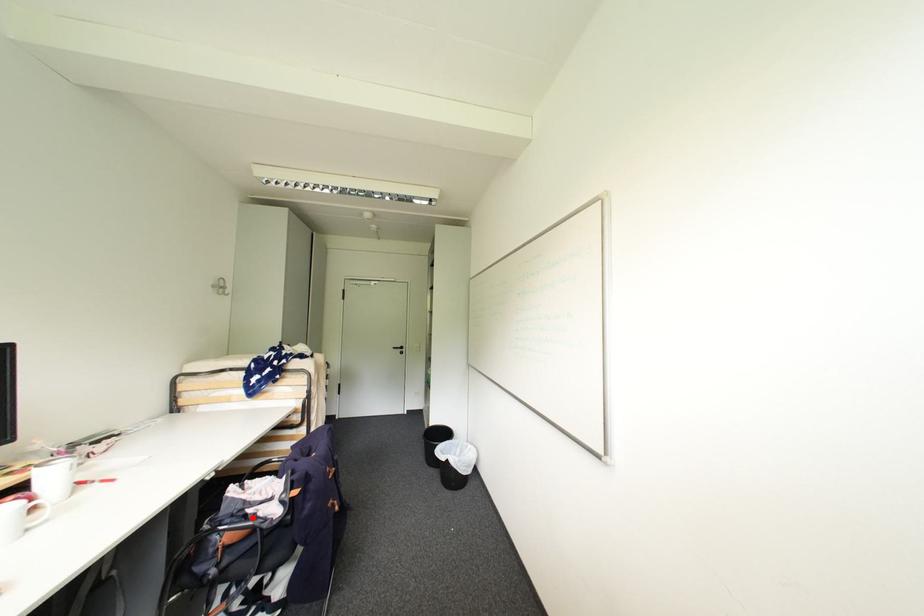
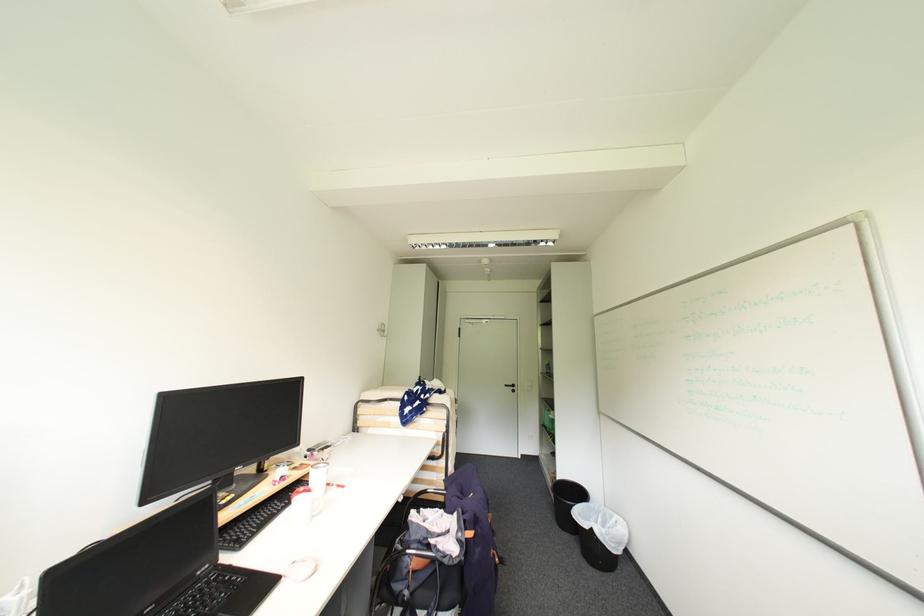
In the second image, find the point that corresponds to the highlighted location in the first image.

(435, 548)